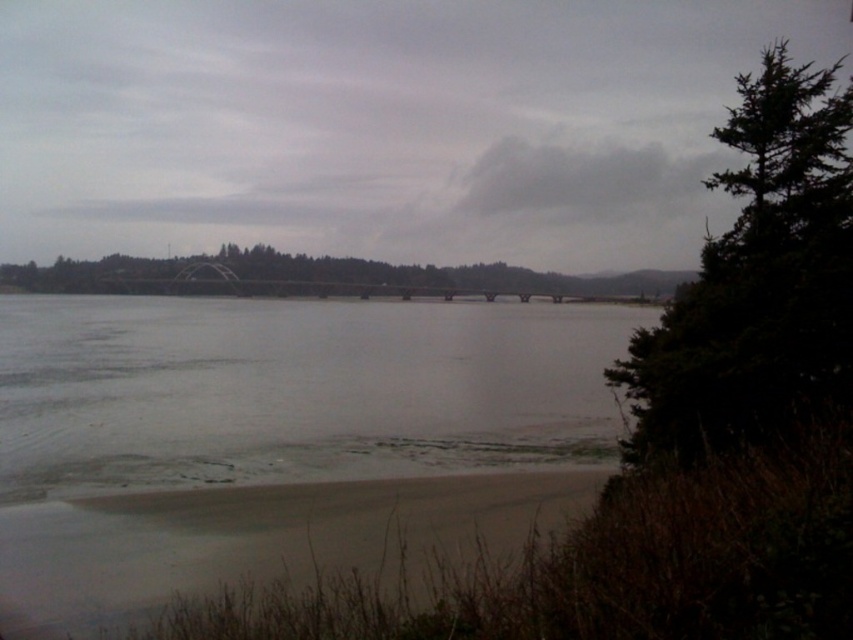
Does clear water at center appear on the left side of dark green textured tree at right?

Yes, clear water at center is to the left of dark green textured tree at right.

What are the coordinates of `clear water at center` in the screenshot? It's located at (294, 388).

At what (x,y) coordinates should I click in order to perform the action: click on clear water at center. Please return your answer as a coordinate pair (x, y). The image size is (853, 640). Looking at the image, I should click on (294, 388).

Is point (524, 365) closer to camera compared to point (129, 589)?

That is False.

Is clear water at center further to camera compared to sandy shore at lower left?

That is True.

Who is more distant from viewer, (601,456) or (90,499)?

Point (601,456)

Where is `clear water at center`? This screenshot has width=853, height=640. clear water at center is located at coordinates (294, 388).

Who is more distant from viewer, (54, 620) or (560, 289)?

The point (560, 289) is behind.

Measure the distance between point (x=47, y=540) and camera.

They are 11.83 meters apart.

This screenshot has height=640, width=853. What do you see at coordinates (254, 538) in the screenshot?
I see `sandy shore at lower left` at bounding box center [254, 538].

Find the location of a particular element. This screenshot has height=640, width=853. sandy shore at lower left is located at coordinates (254, 538).